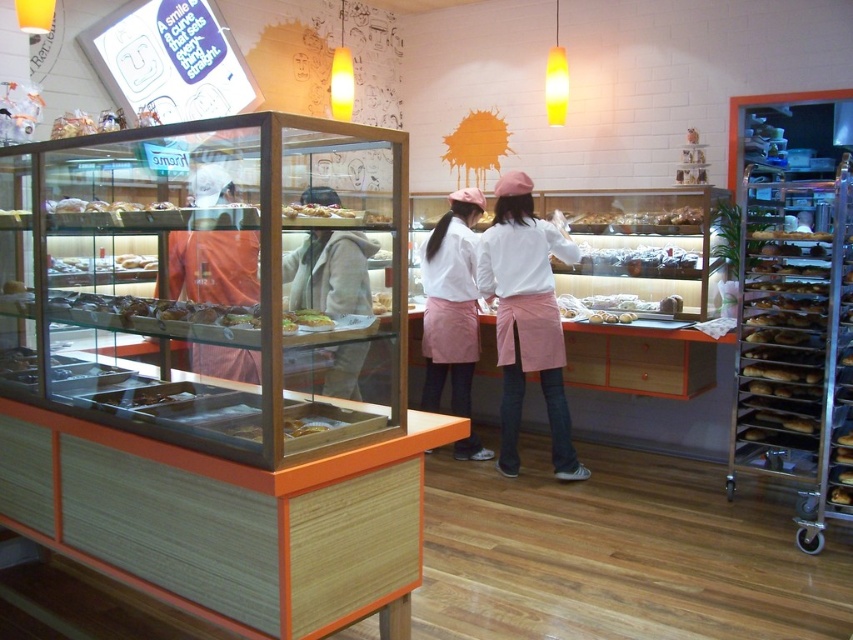
Question: Can you confirm if white cotton shirt at center is positioned to the right of orange fabric at center?

Choices:
 (A) no
 (B) yes

Answer: (B)

Question: Which point is closer to the camera?

Choices:
 (A) matte white bread at center
 (B) golden brown crusty bread at center
 (C) orange fabric at center
 (D) matte glass bread at center

Answer: (D)

Question: Which point appears closest to the camera in this image?

Choices:
 (A) (306, 214)
 (B) (132, 321)
 (C) (186, 285)

Answer: (A)

Question: From the image, what is the correct spatial relationship of orange fabric at center in relation to golden brown crusty bread at center?

Choices:
 (A) above
 (B) below

Answer: (A)

Question: Is white cotton shirt at center wider than matte glass bread at center?

Choices:
 (A) yes
 (B) no

Answer: (A)

Question: Which point appears farthest from the camera in this image?

Choices:
 (A) (421, 406)
 (B) (287, 314)
 (C) (216, 193)
 (D) (294, 205)

Answer: (A)